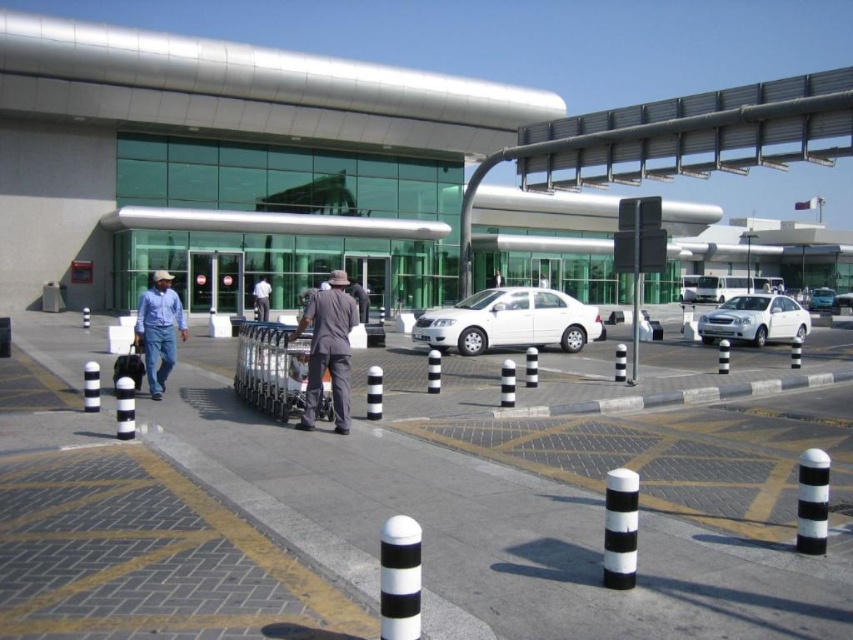
Question: Which of these objects is positioned farthest from the metallic silver airport terminal at center?

Choices:
 (A) white fabric shirt at center
 (B) metallic silver sedan at center

Answer: (A)

Question: Which of the following is the closest to the observer?

Choices:
 (A) white glossy sedan at right
 (B) metallic silver sedan at center
 (C) white fabric shirt at center
 (D) black striped pole at center

Answer: (D)

Question: Among these objects, which one is nearest to the camera?

Choices:
 (A) brown fabric hat at center
 (B) metallic silver airport terminal at center
 (C) white glossy sedan at right
 (D) brown fabric shirt at center

Answer: (A)

Question: Does white matte sedan at center appear under brown fabric hat at center?

Choices:
 (A) no
 (B) yes

Answer: (B)

Question: Does blue jeans at left lie in front of brown fabric shirt at center?

Choices:
 (A) yes
 (B) no

Answer: (A)

Question: Is white matte sedan at center to the left of white fabric shirt at center from the viewer's perspective?

Choices:
 (A) yes
 (B) no

Answer: (B)